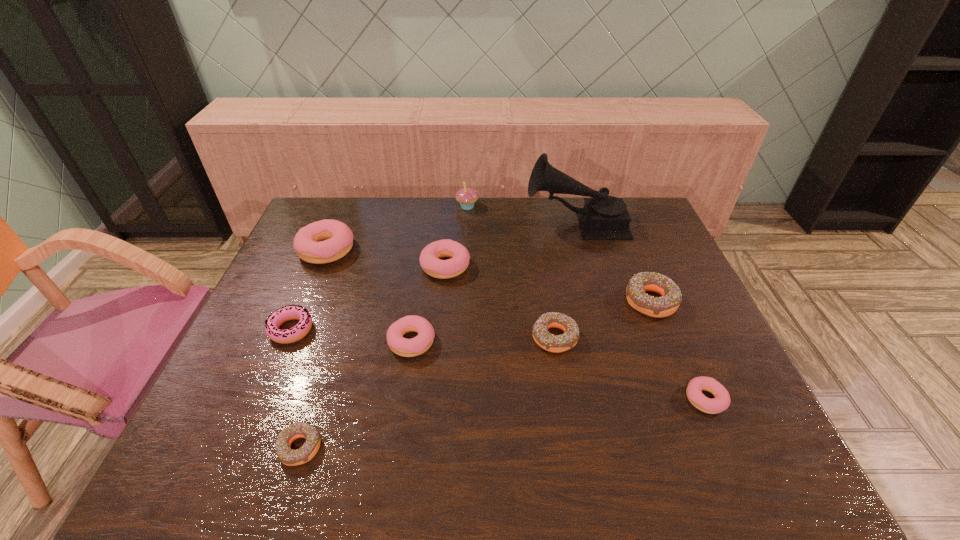
This screenshot has height=540, width=960. Find the location of `the sixth doughnut from left to right`. the sixth doughnut from left to right is located at coordinates (553, 343).

Locate an element on the screen. Image resolution: width=960 pixels, height=540 pixels. the rightmost pink doughnut is located at coordinates (721, 402).

Locate an element on the screen. the nearest pink doughnut is located at coordinates (721, 402).

In order to click on the nearest doughnut in this screenshot , I will do `click(288, 456)`.

Where is `the nearest object`? The width and height of the screenshot is (960, 540). the nearest object is located at coordinates (288, 456).

Where is `vacant space located 0.310m from the horn of the phonograph_record`? vacant space located 0.310m from the horn of the phonograph_record is located at coordinates (435, 222).

You are a GUI agent. You are given a task and a screenshot of the screen. Output one action in this format:
    pyautogui.click(x=<x>, y=<y>)
    Task: Click on the free space located 0.270m from the horn of the phonograph_record
    The height and width of the screenshot is (540, 960).
    Given the screenshot: What is the action you would take?
    pyautogui.click(x=446, y=222)

This screenshot has height=540, width=960. Find the location of `vacant area located 0.230m from the horn of the phonograph_record`. vacant area located 0.230m from the horn of the phonograph_record is located at coordinates (458, 222).

Find the location of `vacant space located on the left of the cupcake`. vacant space located on the left of the cupcake is located at coordinates (361, 207).

You are a GUI agent. You are given a task and a screenshot of the screen. Output one action in this format:
    pyautogui.click(x=<x>, y=<y>)
    Task: Click on the free space located on the front of the biggest pink doughnut
    
    Given the screenshot: What is the action you would take?
    pyautogui.click(x=307, y=296)